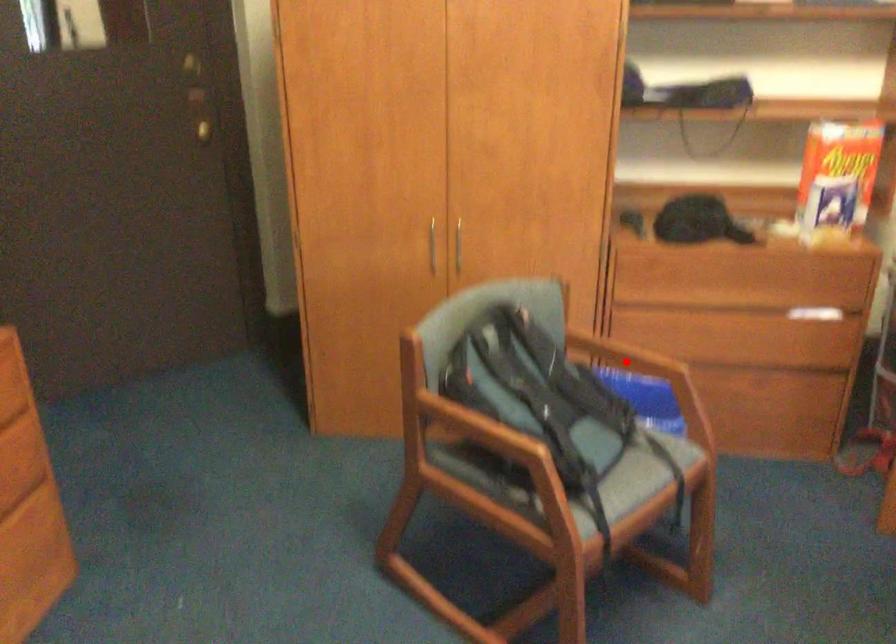
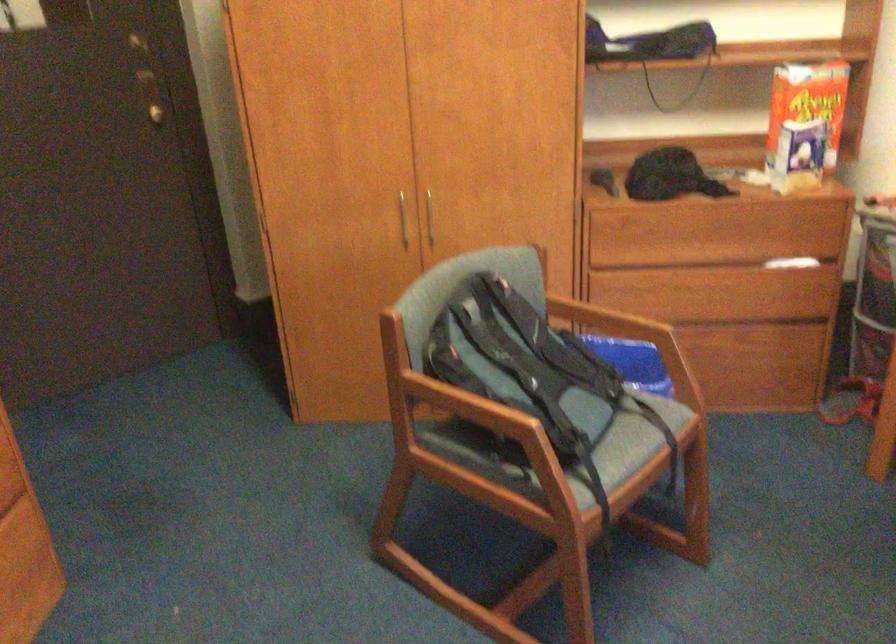
Find the pixel in the second image that matches the highlighted location in the first image.

(609, 325)